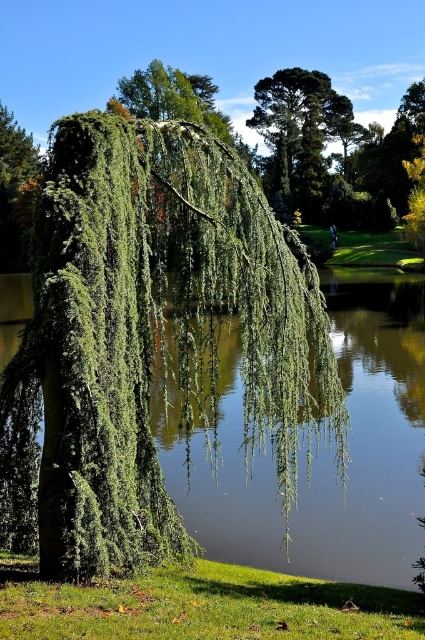
You are standing at the center of the image and want to walk towards the green leafy willow at center. In which direction should you move?

Since the green leafy willow at center is already at the center of the image, you are already facing it. There is no need to move in any direction.

You are standing in the scene and want to place a picnic blanket. Given the green grass at lower left and the green leafy tree at upper center, which area would be more suitable for placing the blanket based on their size?

The green leafy tree at upper center occupies more space than the green grass at lower left, so placing the picnic blanket in the area with the green grass at lower left would be more suitable since it is smaller and likely has enough space for the blanket.

You are a gardener planning to plant a new flower bed between the green leafy willow at center and the green grass at lower left. Considering their widths, which area should you choose to ensure the flower bed has enough space?

The green leafy willow at center has a greater width than the green grass at lower left, so you should choose the area near the green leafy willow at center to ensure the flower bed has enough space.